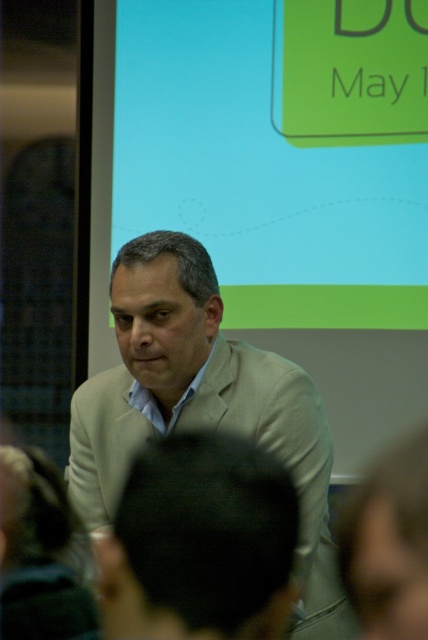
Does matte green projection screen at upper center have a greater width compared to beige fabric suit at center?

Correct, the width of matte green projection screen at upper center exceeds that of beige fabric suit at center.

Who is positioned more to the left, matte green projection screen at upper center or beige fabric suit at center?

beige fabric suit at center is more to the left.

Between point (149, 96) and point (133, 595), which one is positioned in front?

Point (133, 595) is more forward.

Find the location of a particular element. The width and height of the screenshot is (428, 640). matte green projection screen at upper center is located at coordinates (281, 150).

Who is positioned more to the right, matte green projection screen at upper center or beige sweater at center?

Positioned to the right is matte green projection screen at upper center.

What do you see at coordinates (281, 150) in the screenshot? The width and height of the screenshot is (428, 640). I see `matte green projection screen at upper center` at bounding box center [281, 150].

Image resolution: width=428 pixels, height=640 pixels. What do you see at coordinates (281, 150) in the screenshot?
I see `matte green projection screen at upper center` at bounding box center [281, 150].

Locate an element on the screen. This screenshot has width=428, height=640. matte green projection screen at upper center is located at coordinates (281, 150).

How distant is beige sweater at center from beige fabric suit at center?

beige sweater at center and beige fabric suit at center are 27.84 inches apart.

Is point (326, 442) in front of point (250, 522)?

No.

This screenshot has height=640, width=428. In order to click on beige sweater at center in this screenshot , I will do `click(202, 404)`.

Where is `beige sweater at center`? The image size is (428, 640). beige sweater at center is located at coordinates (202, 404).